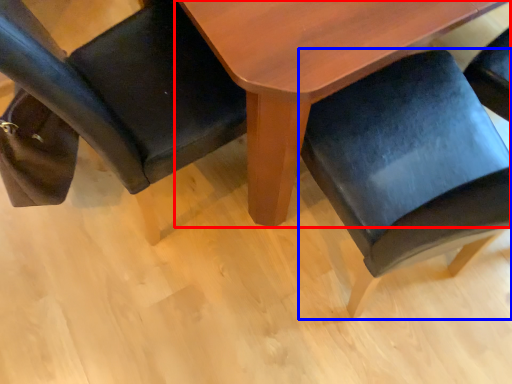
Question: Which object appears farthest to the camera in this image, table (highlighted by a red box) or chair (highlighted by a blue box)?

Choices:
 (A) table
 (B) chair

Answer: (A)